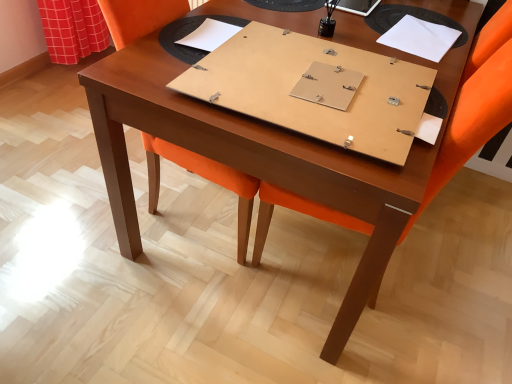
In order to click on vacant area that is in front of white cardboard notebook at upper center, placed as the 3th notebook when sorted from right to left in this screenshot , I will do `click(225, 66)`.